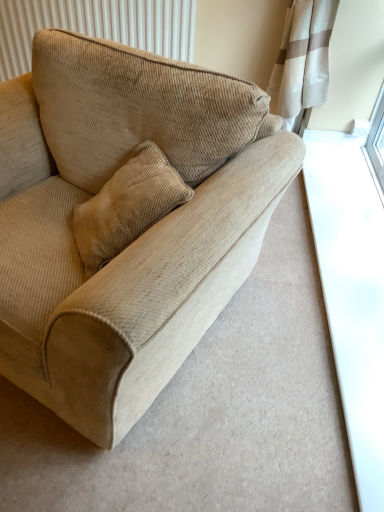
Image resolution: width=384 pixels, height=512 pixels. What do you see at coordinates (97, 26) in the screenshot?
I see `beige corduroy radiator at upper left` at bounding box center [97, 26].

Where is `beige corduroy radiator at upper left`? The height and width of the screenshot is (512, 384). beige corduroy radiator at upper left is located at coordinates (97, 26).

Describe the element at coordinates (135, 240) in the screenshot. I see `beige corduroy couch at center` at that location.

Locate an element on the screen. beige corduroy couch at center is located at coordinates (135, 240).

Locate an element on the screen. beige corduroy radiator at upper left is located at coordinates (97, 26).

Between beige corduroy couch at center and beige corduroy radiator at upper left, which one appears on the left side from the viewer's perspective?

beige corduroy radiator at upper left.

Which object is further away from the camera taking this photo, beige corduroy couch at center or beige corduroy radiator at upper left?

beige corduroy radiator at upper left is further away from the camera.

Considering the positions of point (31, 232) and point (31, 46), is point (31, 232) closer or farther from the camera than point (31, 46)?

Clearly, point (31, 232) is closer to the camera than point (31, 46).

From the image's perspective, would you say beige corduroy couch at center is positioned over beige corduroy radiator at upper left?

Actually, beige corduroy couch at center appears below beige corduroy radiator at upper left in the image.

From a real-world perspective, is beige corduroy couch at center physically below beige corduroy radiator at upper left?

Yes, from a real-world perspective, beige corduroy couch at center is under beige corduroy radiator at upper left.

Can you confirm if beige corduroy couch at center is thinner than beige corduroy radiator at upper left?

Incorrect, the width of beige corduroy couch at center is not less than that of beige corduroy radiator at upper left.

In terms of height, does beige corduroy couch at center look taller or shorter compared to beige corduroy radiator at upper left?

Clearly, beige corduroy couch at center is taller compared to beige corduroy radiator at upper left.

Can you confirm if beige corduroy couch at center is smaller than beige corduroy radiator at upper left?

No, beige corduroy couch at center is not smaller than beige corduroy radiator at upper left.

Would you say beige corduroy couch at center contains beige corduroy radiator at upper left?

No, beige corduroy radiator at upper left is not surrounded by beige corduroy couch at center.

Are beige corduroy couch at center and beige corduroy radiator at upper left beside each other?

There is a gap between beige corduroy couch at center and beige corduroy radiator at upper left.

Is beige corduroy couch at center facing towards beige corduroy radiator at upper left?

No, beige corduroy couch at center is not facing towards beige corduroy radiator at upper left.

Where is `studio couch on the right of beige corduroy radiator at upper left`? The width and height of the screenshot is (384, 512). studio couch on the right of beige corduroy radiator at upper left is located at coordinates (135, 240).

Considering the positions of objects beige corduroy radiator at upper left and beige corduroy couch at center in the image provided, who is more to the left, beige corduroy radiator at upper left or beige corduroy couch at center?

Positioned to the left is beige corduroy radiator at upper left.

Which object is further away from the camera taking this photo, beige corduroy radiator at upper left or beige corduroy couch at center?

beige corduroy radiator at upper left is further away from the camera.

Considering the points (11, 47) and (9, 319), which point is in front, point (11, 47) or point (9, 319)?

Point (9, 319)

From the image's perspective, relative to beige corduroy couch at center, is beige corduroy radiator at upper left above or below?

beige corduroy radiator at upper left is above beige corduroy couch at center.

From a real-world perspective, is beige corduroy radiator at upper left below beige corduroy couch at center?

No, from a real-world perspective, beige corduroy radiator at upper left is not beneath beige corduroy couch at center.

Can you confirm if beige corduroy radiator at upper left is wider than beige corduroy couch at center?

In fact, beige corduroy radiator at upper left might be narrower than beige corduroy couch at center.

Considering the relative sizes of beige corduroy radiator at upper left and beige corduroy couch at center in the image provided, is beige corduroy radiator at upper left shorter than beige corduroy couch at center?

Correct, beige corduroy radiator at upper left is not as tall as beige corduroy couch at center.

Is beige corduroy radiator at upper left bigger or smaller than beige corduroy couch at center?

Clearly, beige corduroy radiator at upper left is smaller in size than beige corduroy couch at center.

Which is correct: beige corduroy radiator at upper left is inside beige corduroy couch at center, or outside of it?

beige corduroy radiator at upper left is not inside beige corduroy couch at center, it's outside.

Is beige corduroy radiator at upper left placed right next to beige corduroy couch at center?

There is a gap between beige corduroy radiator at upper left and beige corduroy couch at center.

Is beige corduroy radiator at upper left positioned with its back to beige corduroy couch at center?

beige corduroy radiator at upper left is not turned away from beige corduroy couch at center.

How many degrees apart are the facing directions of beige corduroy radiator at upper left and beige corduroy couch at center?

They differ by 25.7 degrees in their facing directions.

Locate an element on the screen. This screenshot has width=384, height=512. radiator located above the beige corduroy couch at center (from a real-world perspective) is located at coordinates (97, 26).

Locate an element on the screen. The image size is (384, 512). radiator located on the left of beige corduroy couch at center is located at coordinates (97, 26).

Find the location of a particular element. radiator above the beige corduroy couch at center (from the image's perspective) is located at coordinates (97, 26).